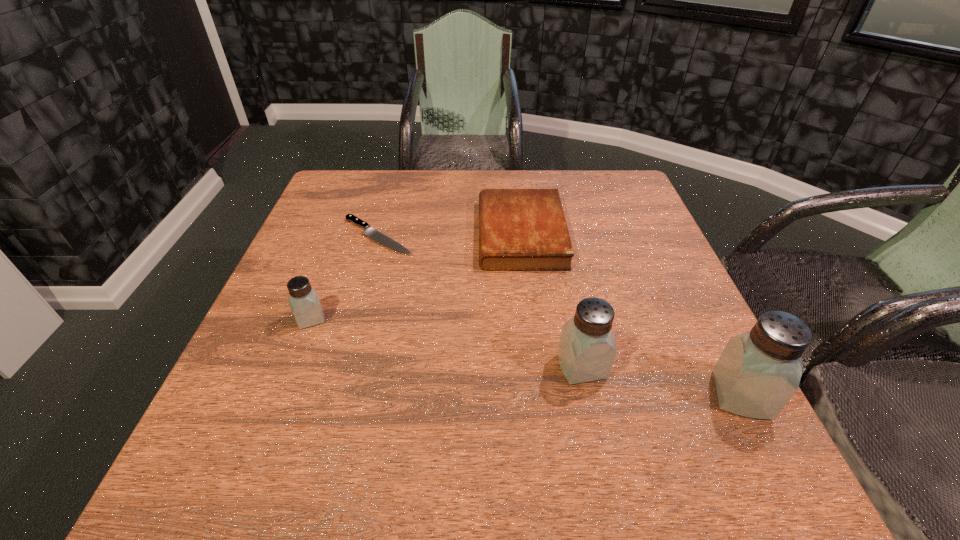
You are a GUI agent. You are given a task and a screenshot of the screen. Output one action in this format:
    pyautogui.click(x=<x>, y=<y>)
    Task: Click on the vacant space at the near edge
    This screenshot has height=540, width=960.
    Given the screenshot: What is the action you would take?
    pyautogui.click(x=322, y=412)

The height and width of the screenshot is (540, 960). In the image, there is a desktop. Identify the location of vacant space at the left edge. (327, 258).

The image size is (960, 540). I want to click on vacant space at the far left corner of the desktop, so 377,183.

What are the coordinates of `vacant space at the near left corner` in the screenshot? It's located at (225, 403).

Where is `vacant space at the far right corner of the desktop`? The height and width of the screenshot is (540, 960). vacant space at the far right corner of the desktop is located at coordinates (591, 186).

Find the location of a particular element. This screenshot has height=540, width=960. vacant point located between the second shortest saltshaker and the fourth tallest object is located at coordinates (551, 300).

You are a GUI agent. You are given a task and a screenshot of the screen. Output one action in this format:
    pyautogui.click(x=<x>, y=<y>)
    Task: Click on the free area in between the second tallest saltshaker and the steak knife
    
    Given the screenshot: What is the action you would take?
    pyautogui.click(x=480, y=301)

You are a GUI agent. You are given a task and a screenshot of the screen. Output one action in this format:
    pyautogui.click(x=<x>, y=<y>)
    Task: Click on the vacant point located between the second tallest saltshaker and the Bible
    The width and height of the screenshot is (960, 540).
    Given the screenshot: What is the action you would take?
    pyautogui.click(x=551, y=300)

Identify the location of unoccupied position between the shortest object and the rightmost object. (560, 315).

The height and width of the screenshot is (540, 960). I want to click on free space between the third farthest object and the second shortest saltshaker, so click(x=446, y=343).